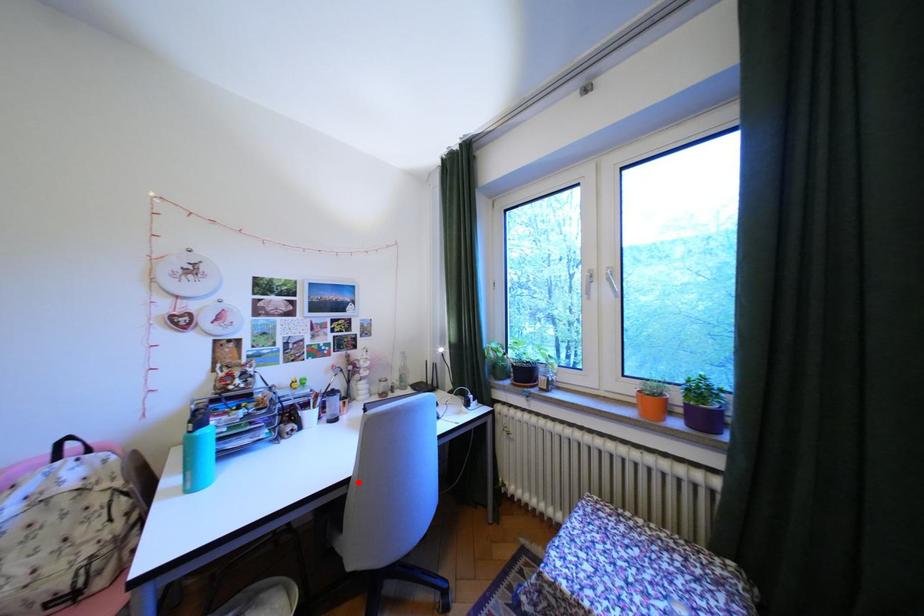
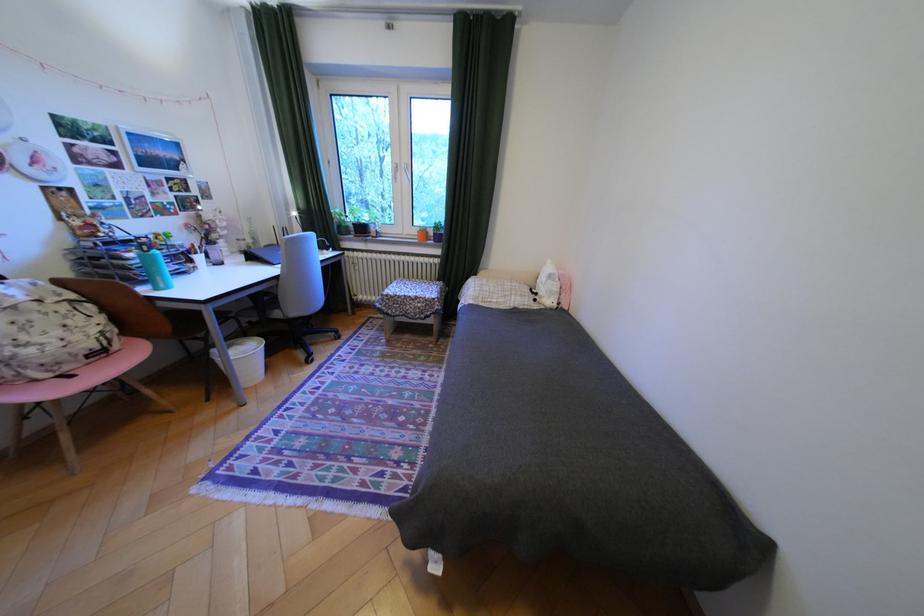
Question: I am providing you with two images of the same scene from different viewpoints. A red point is shown in image1. For the corresponding object point in image2, is it positioned nearer or farther from the camera?

Choices:
 (A) Nearer
 (B) Farther

Answer: (A)